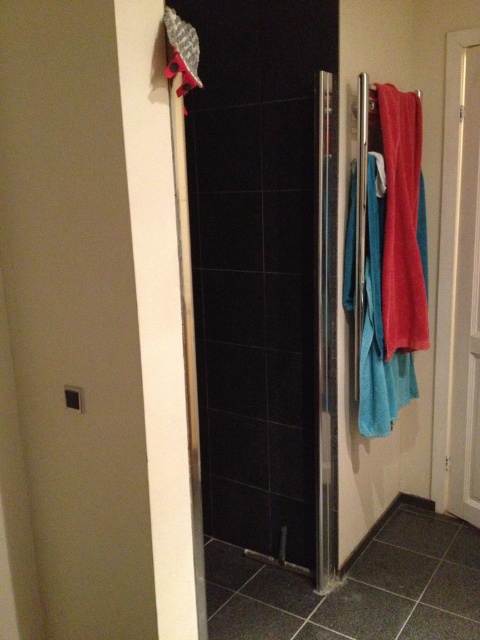
You are in a bathroom and need to reach the matte red towel at right to dry yourself. The white glossy door at right is in your way. Can you move the door to access the towel?

The white glossy door at right is positioned under the matte red towel at right, so you can move the door upwards to access the towel.

You are in a bathroom and need to reach the white glossy door at right to exit. There is a matte red towel at right hanging from a rack. Can you open the door without moving the towel?

The white glossy door at right is to the right of the matte red towel at right, so you can open the door without moving the towel since it is positioned further to the right.